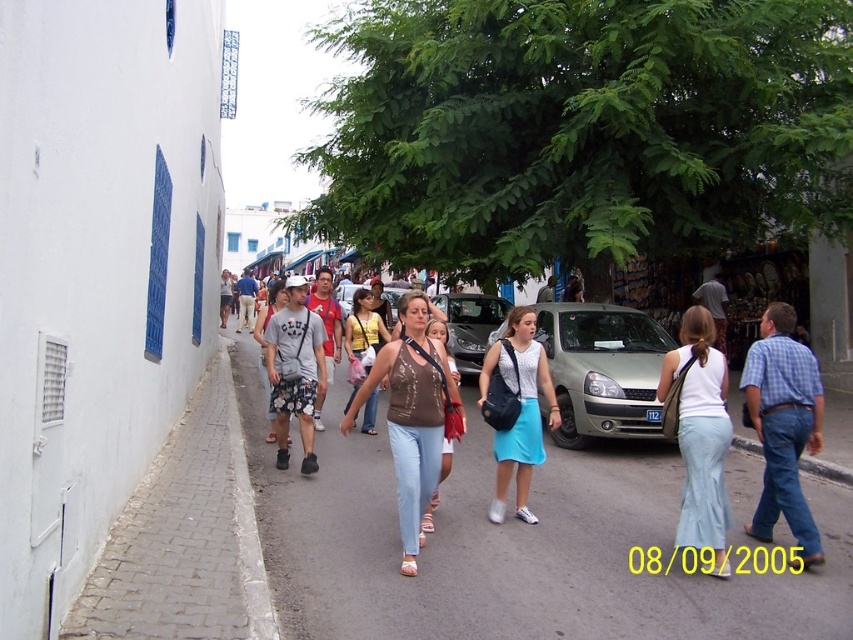
Question: Which point appears closest to the camera in this image?

Choices:
 (A) (612, 417)
 (B) (473, 326)

Answer: (A)

Question: Does satin gold car at center have a lesser width compared to brown leather purse at center?

Choices:
 (A) no
 (B) yes

Answer: (A)

Question: Which point is closer to the camera taking this photo?

Choices:
 (A) (482, 352)
 (B) (630, 310)

Answer: (B)

Question: Does white cotton skirt at center come behind light blue skirt at center?

Choices:
 (A) yes
 (B) no

Answer: (B)

Question: Is matte brown tank top at center thinner than matte gray tank top at center?

Choices:
 (A) yes
 (B) no

Answer: (A)

Question: Which of these objects is positioned farthest from the light blue skirt at center?

Choices:
 (A) matte gray tank top at center
 (B) metallic silver car at center
 (C) brown leather purse at center
 (D) satin gold car at center

Answer: (B)